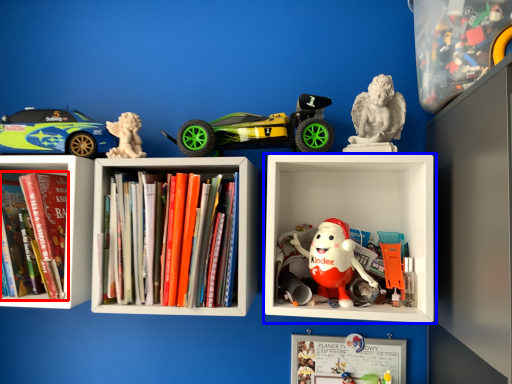
Question: Which object appears farthest to the camera in this image, book (highlighted by a red box) or shelf (highlighted by a blue box)?

Choices:
 (A) book
 (B) shelf

Answer: (A)